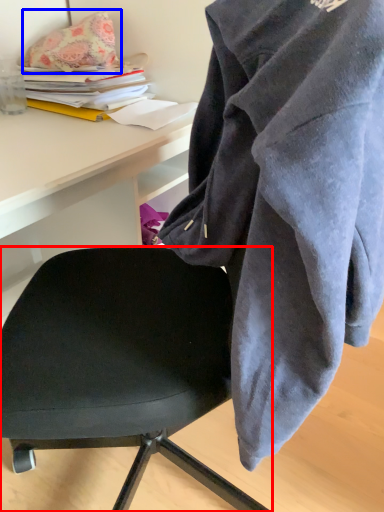
Question: Which of the following is the farthest to the observer, chair (highlighted by a red box) or pillow (highlighted by a blue box)?

Choices:
 (A) chair
 (B) pillow

Answer: (B)